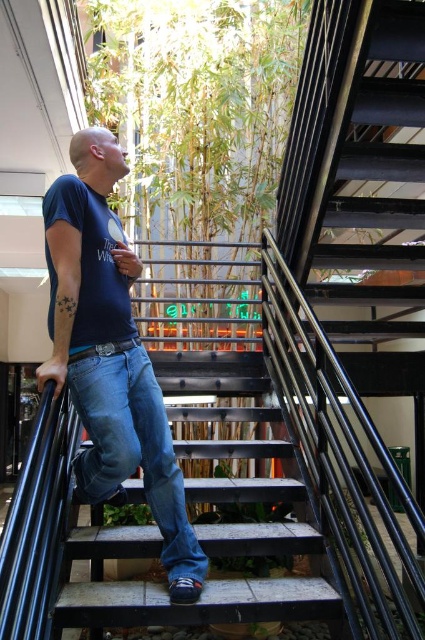
Is denim at center positioned behind blue cotton t-shirt at center?

No, denim at center is closer to the viewer.

Consider the image. Who is positioned more to the left, denim at center or blue cotton t-shirt at center?

Positioned to the left is blue cotton t-shirt at center.

Does point (192, 529) lie in front of point (87, 282)?

That is False.

At what (x,y) coordinates should I click in order to perform the action: click on denim at center. Please return your answer as a coordinate pair (x, y). Looking at the image, I should click on (133, 448).

Is point (93, 364) positioned behind point (167, 451)?

No.

Consider the image. How much distance is there between blue denim jeans at center and denim at center?

blue denim jeans at center and denim at center are 3.28 inches apart.

Is point (98, 332) positioned behind point (178, 564)?

No, (98, 332) is closer to viewer.

Find the location of `blue denim jeans at center`. blue denim jeans at center is located at coordinates (110, 355).

Is blue denim jeans at center positioned at the back of blue cotton t-shirt at center?

No, blue denim jeans at center is closer to the viewer.

Does blue denim jeans at center have a greater height compared to blue cotton t-shirt at center?

Yes, blue denim jeans at center is taller than blue cotton t-shirt at center.

What are the coordinates of `blue denim jeans at center` in the screenshot? It's located at (110, 355).